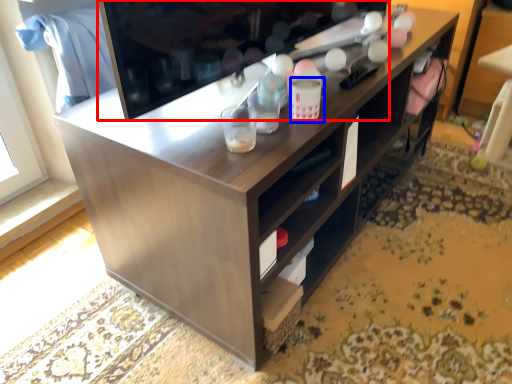
Question: Among these objects, which one is nearest to the camera, television (highlighted by a red box) or beverage (highlighted by a blue box)?

Choices:
 (A) television
 (B) beverage

Answer: (A)